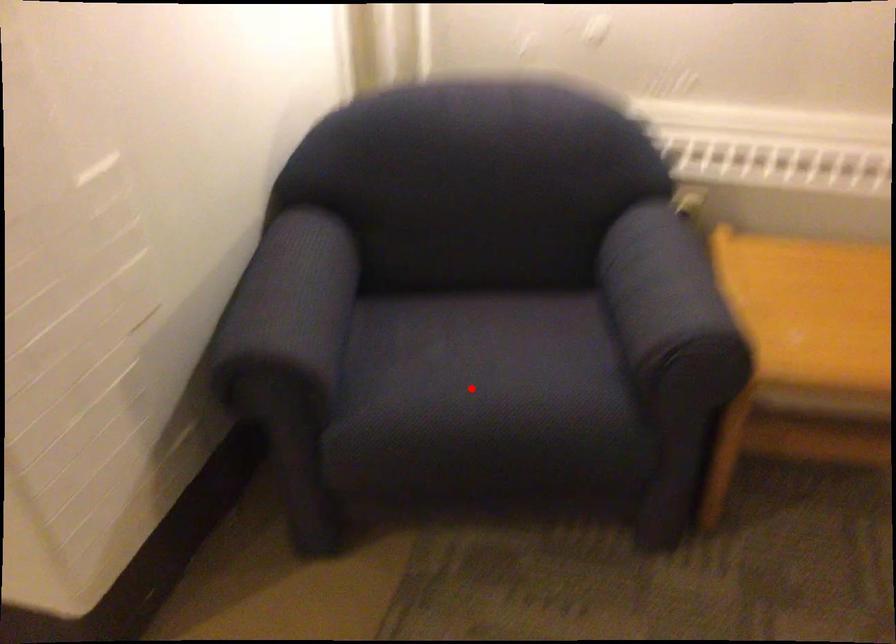
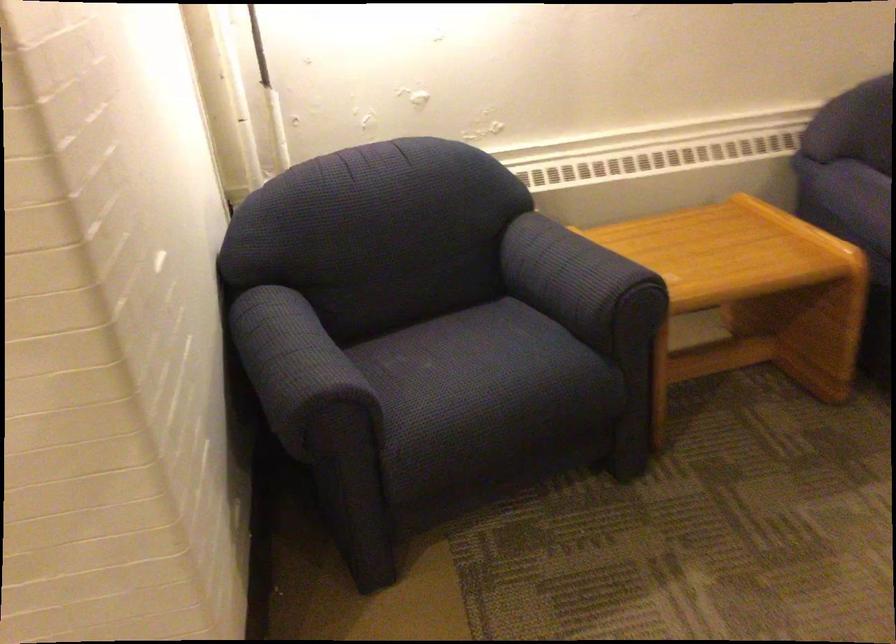
Question: I am providing you with two images of the same scene from different viewpoints. A red point is shown in image1. For the corresponding object point in image2, is it positioned nearer or farther from the camera?

Choices:
 (A) Nearer
 (B) Farther

Answer: (B)